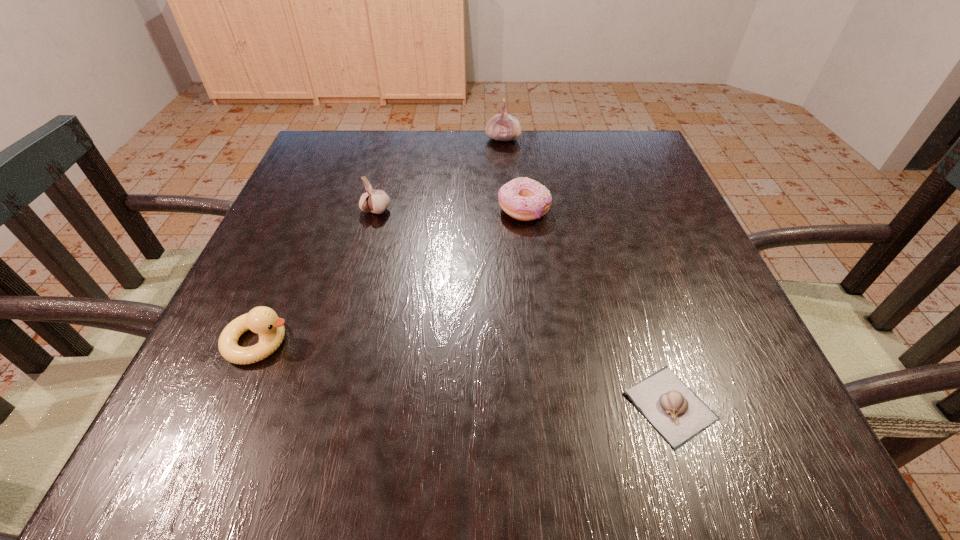
You are a GUI agent. You are given a task and a screenshot of the screen. Output one action in this format:
    pyautogui.click(x=<x>, y=<y>)
    Task: Click on the second garlic from left to right
    Image resolution: width=960 pixels, height=540 pixels.
    Given the screenshot: What is the action you would take?
    click(x=503, y=127)

The width and height of the screenshot is (960, 540). What are the coordinates of `the farthest object` in the screenshot? It's located at (503, 127).

Identify the location of the second nearest garlic. The height and width of the screenshot is (540, 960). (376, 201).

Where is `the leftmost garlic`? Image resolution: width=960 pixels, height=540 pixels. the leftmost garlic is located at coordinates (376, 201).

The width and height of the screenshot is (960, 540). What are the coordinates of `the leftmost object` in the screenshot? It's located at point(262,320).

What are the coordinates of `doughnut` in the screenshot? It's located at (525, 199).

Where is `the shortest object`? the shortest object is located at coordinates (676, 412).

Locate an element on the screen. Image resolution: width=960 pixels, height=540 pixels. the shortest garlic is located at coordinates (676, 412).

The height and width of the screenshot is (540, 960). What are the coordinates of `free location located 0.100m on the front of the second garlic from left to right` in the screenshot? It's located at (505, 168).

Locate an element on the screen. The height and width of the screenshot is (540, 960). free space located on the right of the second nearest garlic is located at coordinates (496, 211).